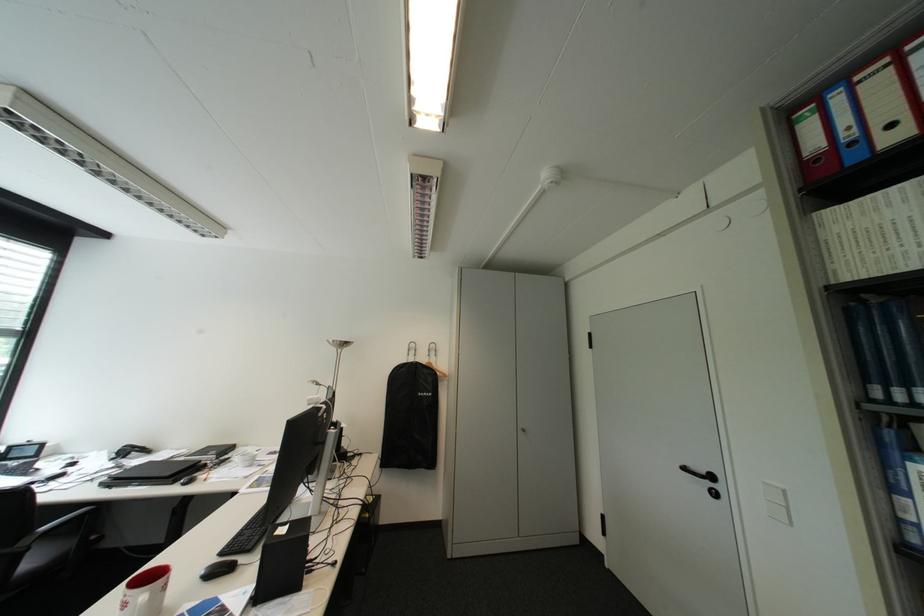
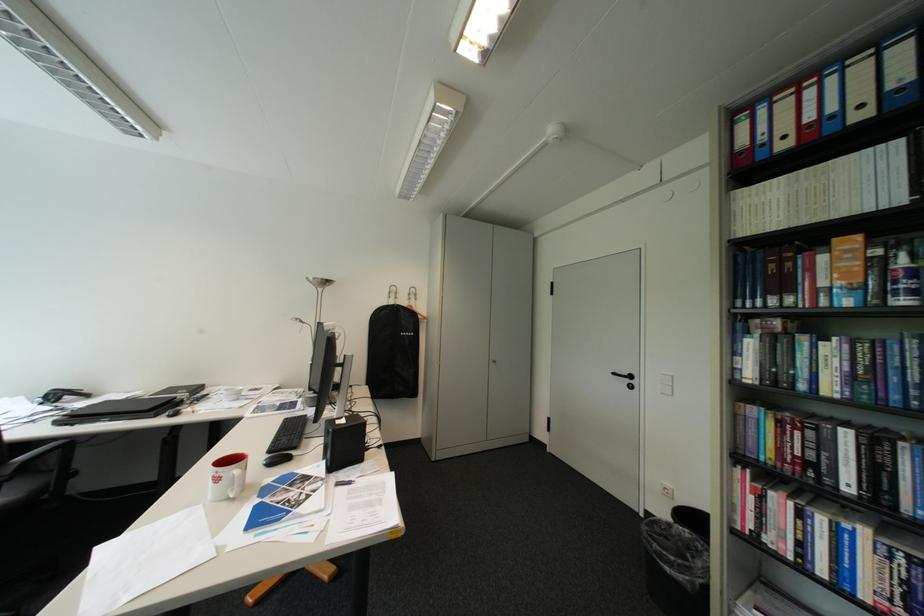
In a continuous first-person perspective shot, in which direction is the camera moving?

The movement direction of the cameraman is left, backward.